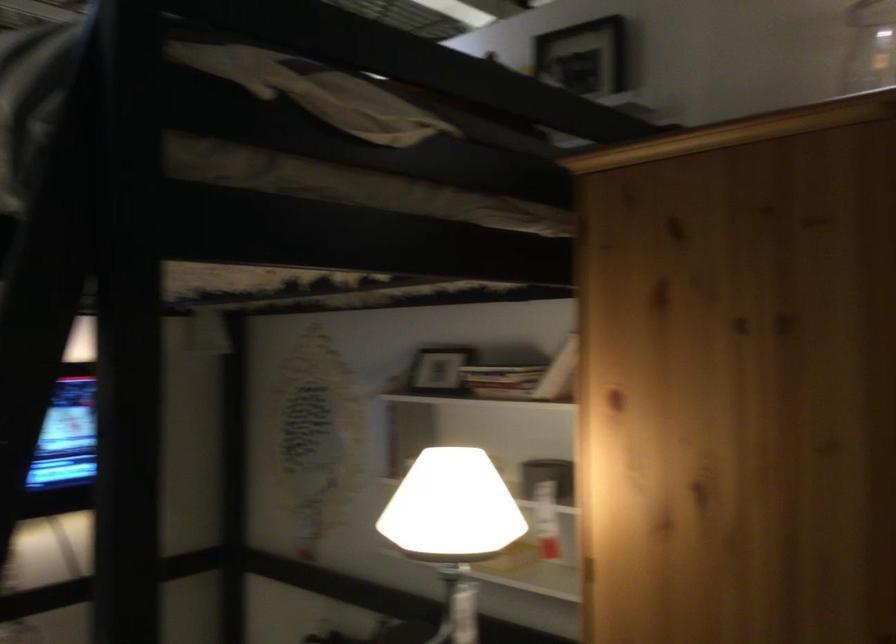
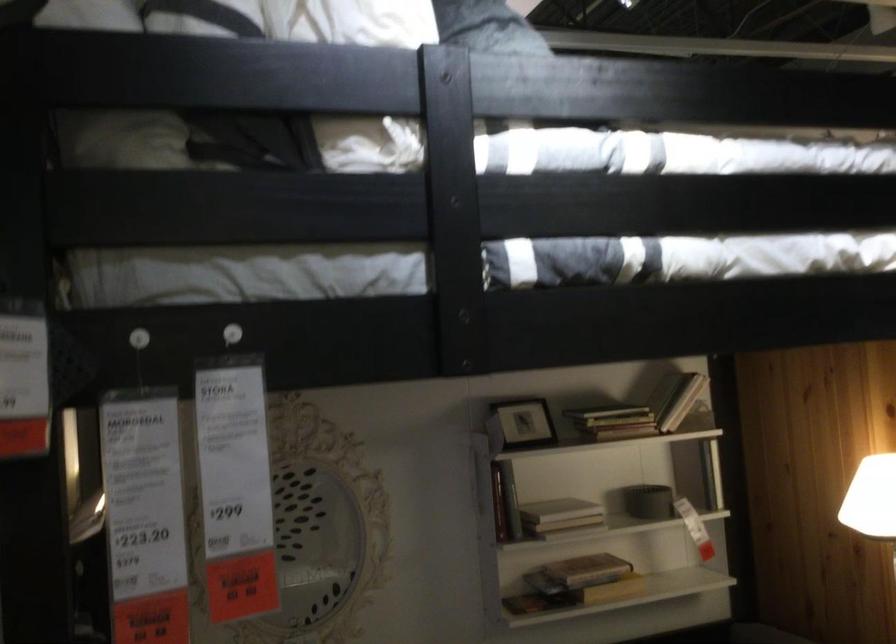
Locate, in the second image, the point that corresponds to pixel 426 371 in the first image.

(522, 422)